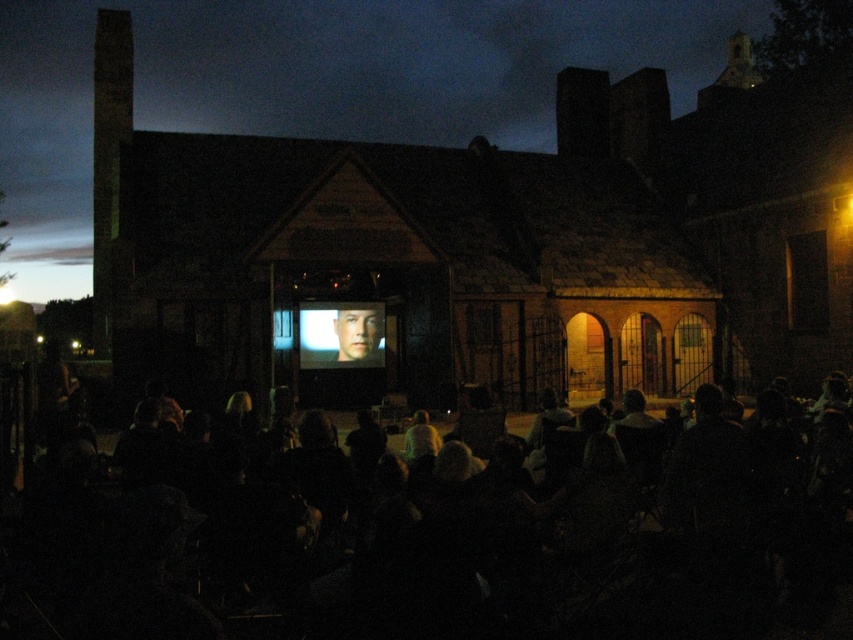
Question: Which point is closer to the camera taking this photo?

Choices:
 (A) (410, 624)
 (B) (341, 324)

Answer: (A)

Question: Does black fabric chairs at lower center appear on the right side of matte silver screen at center?

Choices:
 (A) no
 (B) yes

Answer: (B)

Question: Is black fabric chairs at lower center bigger than matte silver screen at center?

Choices:
 (A) no
 (B) yes

Answer: (B)

Question: Which object is closer to the camera taking this photo?

Choices:
 (A) matte silver screen at center
 (B) black fabric chairs at lower center

Answer: (B)

Question: Among these points, which one is farthest from the camera?

Choices:
 (A) (376, 360)
 (B) (44, 518)

Answer: (A)

Question: Is black fabric chairs at lower center to the right of matte silver screen at center from the viewer's perspective?

Choices:
 (A) yes
 (B) no

Answer: (A)